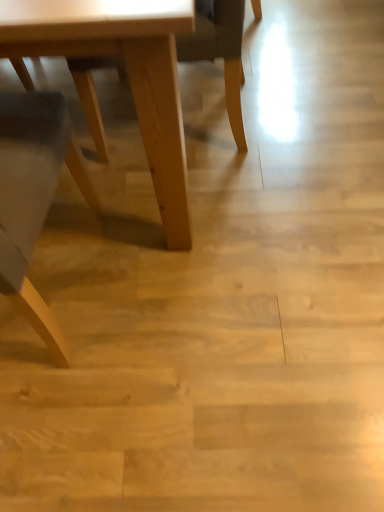
Question: Considering the relative positions of light brown wood chair at center and light wood table at lower left in the image provided, is light brown wood chair at center to the left of light wood table at lower left from the viewer's perspective?

Choices:
 (A) no
 (B) yes

Answer: (A)

Question: Does light brown wood chair at center have a greater height compared to light wood table at lower left?

Choices:
 (A) no
 (B) yes

Answer: (A)

Question: Is light brown wood chair at center directly adjacent to light wood table at lower left?

Choices:
 (A) yes
 (B) no

Answer: (B)

Question: Does light brown wood chair at center have a larger size compared to light wood table at lower left?

Choices:
 (A) yes
 (B) no

Answer: (B)

Question: Does light brown wood chair at center have a smaller size compared to light wood table at lower left?

Choices:
 (A) no
 (B) yes

Answer: (B)

Question: Is light brown wood chair at center positioned behind light wood table at lower left?

Choices:
 (A) yes
 (B) no

Answer: (A)

Question: From the image's perspective, is light wood table at lower left under light brown wood chair at center?

Choices:
 (A) no
 (B) yes

Answer: (B)

Question: Does light wood table at lower left lie behind light brown wood chair at center?

Choices:
 (A) no
 (B) yes

Answer: (A)

Question: From the image's perspective, is light wood table at lower left located above light brown wood chair at center?

Choices:
 (A) no
 (B) yes

Answer: (A)

Question: Is light wood table at lower left to the right of light brown wood chair at center from the viewer's perspective?

Choices:
 (A) no
 (B) yes

Answer: (A)

Question: Considering the relative sizes of light wood table at lower left and light brown wood chair at center in the image provided, is light wood table at lower left wider than light brown wood chair at center?

Choices:
 (A) no
 (B) yes

Answer: (B)

Question: Can we say light wood table at lower left lies outside light brown wood chair at center?

Choices:
 (A) yes
 (B) no

Answer: (A)

Question: In the image, is light brown wood chair at center positioned in front of or behind light wood table at lower left?

Choices:
 (A) behind
 (B) front

Answer: (A)